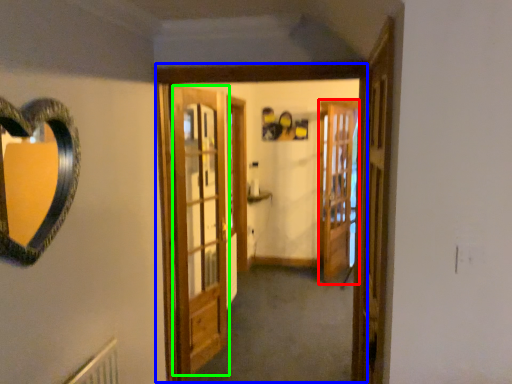
Question: Estimate the real-world distances between objects in this image. Which object is closer to screen door (highlighted by a red box), window frame (highlighted by a blue box) or barn door (highlighted by a green box)?

Choices:
 (A) window frame
 (B) barn door

Answer: (B)